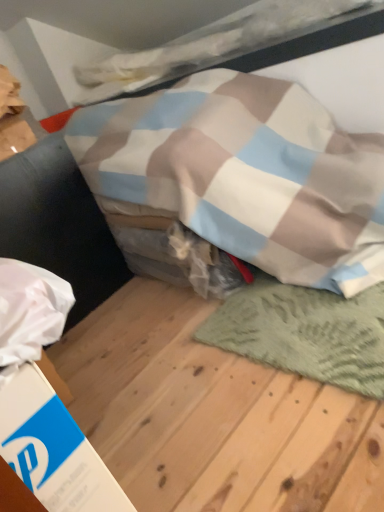
Question: Considering the relative positions of white cardboard box at lower left and green knitted mat at lower right in the image provided, is white cardboard box at lower left to the left of green knitted mat at lower right from the viewer's perspective?

Choices:
 (A) yes
 (B) no

Answer: (A)

Question: Considering the relative sizes of white cardboard box at lower left and green knitted mat at lower right in the image provided, is white cardboard box at lower left wider than green knitted mat at lower right?

Choices:
 (A) yes
 (B) no

Answer: (B)

Question: Does white cardboard box at lower left have a lesser width compared to green knitted mat at lower right?

Choices:
 (A) yes
 (B) no

Answer: (A)

Question: Can you confirm if white cardboard box at lower left is bigger than green knitted mat at lower right?

Choices:
 (A) yes
 (B) no

Answer: (B)

Question: From a real-world perspective, is white cardboard box at lower left positioned over green knitted mat at lower right based on gravity?

Choices:
 (A) no
 (B) yes

Answer: (B)

Question: Could you tell me if white cardboard box at lower left is facing green knitted mat at lower right?

Choices:
 (A) no
 (B) yes

Answer: (B)

Question: Is green textured rug at lower right aimed at green knitted mat at lower right?

Choices:
 (A) no
 (B) yes

Answer: (B)

Question: From the image's perspective, is green textured rug at lower right located beneath green knitted mat at lower right?

Choices:
 (A) no
 (B) yes

Answer: (B)

Question: Can you confirm if green textured rug at lower right is bigger than green knitted mat at lower right?

Choices:
 (A) no
 (B) yes

Answer: (B)

Question: Does green textured rug at lower right have a greater width compared to green knitted mat at lower right?

Choices:
 (A) yes
 (B) no

Answer: (A)

Question: From a real-world perspective, does green textured rug at lower right stand above green knitted mat at lower right?

Choices:
 (A) yes
 (B) no

Answer: (B)

Question: Is green textured rug at lower right positioned in front of green knitted mat at lower right?

Choices:
 (A) no
 (B) yes

Answer: (B)

Question: From the image's perspective, is green textured rug at lower right on white cardboard box at lower left?

Choices:
 (A) yes
 (B) no

Answer: (A)